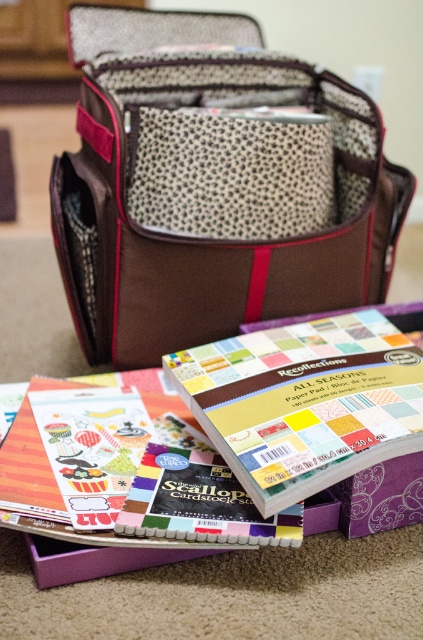
Where is the brown fabric bag at center located in the image?

The brown fabric bag at center is located at point 0.289 on the x axis and 0.504 on the y axis.

You are organizing crafting supplies on the floor. You have a matte paper pad at lower center and a purple cardboard box at lower center. Which object can you place inside the other?

The matte paper pad at lower center has a smaller size compared to purple cardboard box at lower center, so the matte paper pad at lower center can be placed inside the purple cardboard box at lower center.

You are organizing a craft fair and have a limited shelf space. You need to decide whether to place the brown fabric bag at center on top of the purple cardboard box at lower center or vice versa. Based on their sizes, which arrangement would allow the taller item to be placed on top?

The brown fabric bag at center is taller than the purple cardboard box at lower center, so placing the brown fabric bag at center on top of the purple cardboard box at lower center would ensure the taller item is on top.